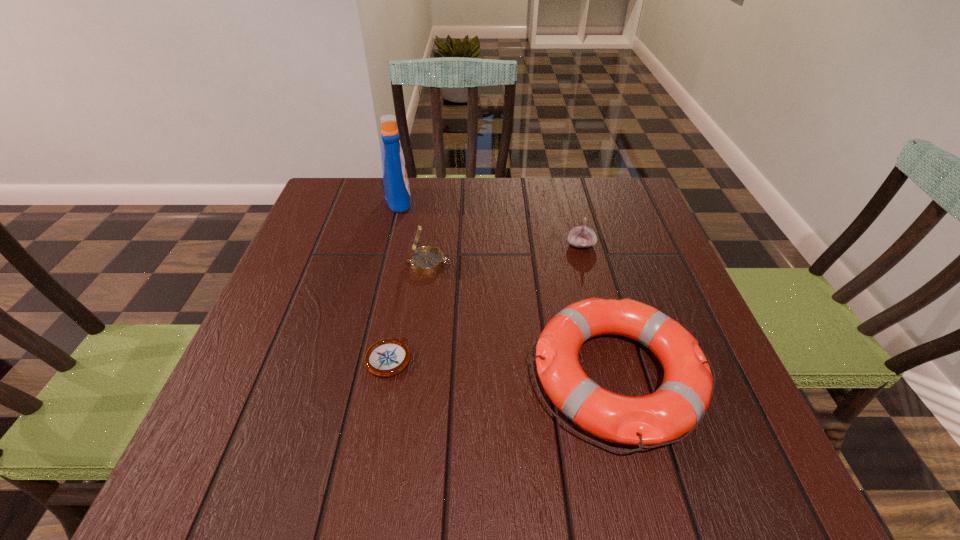
You are a GUI agent. You are given a task and a screenshot of the screen. Output one action in this format:
    pyautogui.click(x=<x>, y=<y>)
    Task: Click on the free space between the shortest object and the taller compass
    
    Given the screenshot: What is the action you would take?
    coord(409,310)

Identify the location of free space between the fourth shortest object and the garlic. (505, 254).

The height and width of the screenshot is (540, 960). I want to click on the third closest object to the taller compass, so click(x=678, y=406).

Locate an element on the screen. The image size is (960, 540). object that stands as the closest to the taller compass is located at coordinates (396, 185).

Locate an element on the screen. This screenshot has width=960, height=540. free space in the image that satisfies the following two spatial constraints: 1. on the label of the tallest object; 2. on the right side of the life buoy is located at coordinates (356, 375).

This screenshot has width=960, height=540. Find the location of `vacant space that satisfies the following two spatial constraints: 1. on the front side of the garlic; 2. on the left side of the life buoy`. vacant space that satisfies the following two spatial constraints: 1. on the front side of the garlic; 2. on the left side of the life buoy is located at coordinates (615, 375).

Where is `free space that satisfies the following two spatial constraints: 1. on the front side of the life buoy; 2. on the right side of the garlic`? The width and height of the screenshot is (960, 540). free space that satisfies the following two spatial constraints: 1. on the front side of the life buoy; 2. on the right side of the garlic is located at coordinates (615, 375).

You are a GUI agent. You are given a task and a screenshot of the screen. Output one action in this format:
    pyautogui.click(x=<x>, y=<y>)
    Task: Click on the vacant space that satisfies the following two spatial constraints: 1. on the front side of the garlic; 2. with the dial facing the farther compass
    The width and height of the screenshot is (960, 540).
    Given the screenshot: What is the action you would take?
    pyautogui.click(x=586, y=263)

Where is `vacant region that satisfies the following two spatial constraints: 1. on the label of the tallest object; 2. on the right side of the life buoy`? vacant region that satisfies the following two spatial constraints: 1. on the label of the tallest object; 2. on the right side of the life buoy is located at coordinates (356, 375).

This screenshot has height=540, width=960. I want to click on free space that satisfies the following two spatial constraints: 1. with the dial facing the fourth shortest object; 2. on the right side of the life buoy, so click(x=415, y=375).